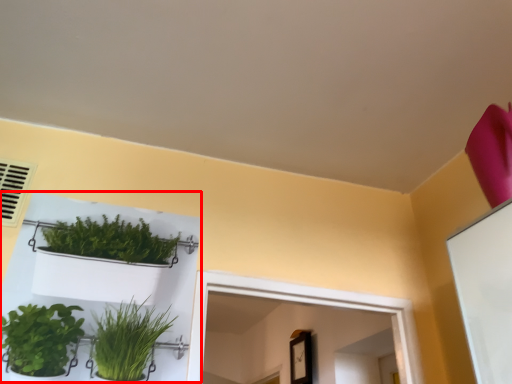
Question: In this image, where is shelf (annotated by the red box) located relative to air conditioning?

Choices:
 (A) right
 (B) left

Answer: (A)